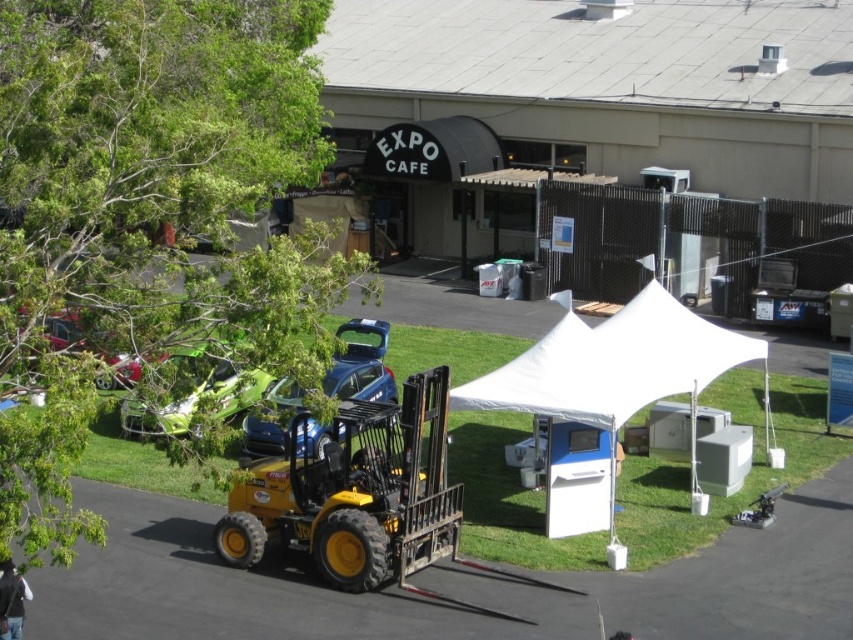
You are a visitor at an outdoor event and see the yellow metallic forklift at center and the green matte car at lower left. Which object is positioned lower in the image?

The yellow metallic forklift at center is located below the green matte car at lower left, so the forklift is positioned lower in the image.

You are a delivery person trying to unload a package from your truck. You need to move the white fabric tent at center to access the area behind it. Is the metallic red car at upper left blocking your path?

The white fabric tent at center is positioned under the metallic red car at upper left, so the metallic red car at upper left is blocking the path to the area behind the tent.

You are standing at the point marked by the coordinates [354,492] in the image. What vehicle are you closest to?

You are closest to the yellow metallic forklift at center, as the point [354,492] represents its location.